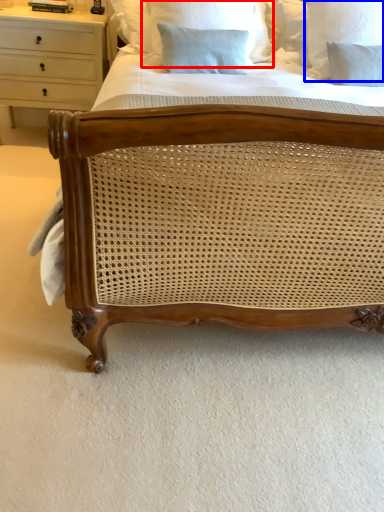
Question: Which object is further to the camera taking this photo, pillow (highlighted by a red box) or pillow (highlighted by a blue box)?

Choices:
 (A) pillow
 (B) pillow

Answer: (B)